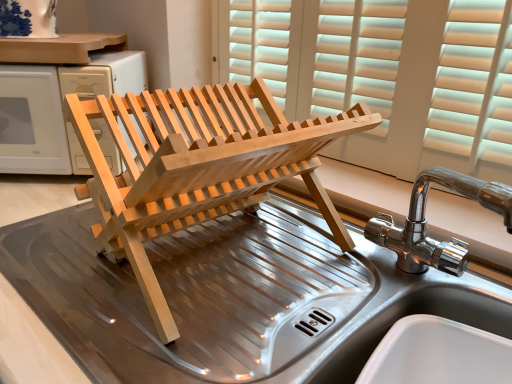
Question: Is natural wood dish rack at center positioned behind natural wood dish rack at center?

Choices:
 (A) no
 (B) yes

Answer: (A)

Question: Is natural wood dish rack at center bigger than natural wood dish rack at center?

Choices:
 (A) no
 (B) yes

Answer: (B)

Question: Is natural wood dish rack at center not within natural wood dish rack at center?

Choices:
 (A) yes
 (B) no

Answer: (A)

Question: Does natural wood dish rack at center appear on the right side of natural wood dish rack at center?

Choices:
 (A) no
 (B) yes

Answer: (B)

Question: Is natural wood dish rack at center looking in the opposite direction of natural wood dish rack at center?

Choices:
 (A) yes
 (B) no

Answer: (B)

Question: From the image's perspective, would you say natural wood dish rack at center is shown under natural wood dish rack at center?

Choices:
 (A) no
 (B) yes

Answer: (B)

Question: Could you tell me if natural wood dish rack at center is turned towards chrome metallic tap at right?

Choices:
 (A) no
 (B) yes

Answer: (A)

Question: Does natural wood dish rack at center have a lesser width compared to chrome metallic tap at right?

Choices:
 (A) no
 (B) yes

Answer: (A)

Question: Is natural wood dish rack at center not within chrome metallic tap at right?

Choices:
 (A) yes
 (B) no

Answer: (A)

Question: Is natural wood dish rack at center directly adjacent to chrome metallic tap at right?

Choices:
 (A) yes
 (B) no

Answer: (B)

Question: Does natural wood dish rack at center have a smaller size compared to chrome metallic tap at right?

Choices:
 (A) no
 (B) yes

Answer: (A)

Question: Does natural wood dish rack at center contain chrome metallic tap at right?

Choices:
 (A) yes
 (B) no

Answer: (B)

Question: Does stainless steel sink at center have a lesser width compared to natural wood dish rack at center?

Choices:
 (A) yes
 (B) no

Answer: (A)